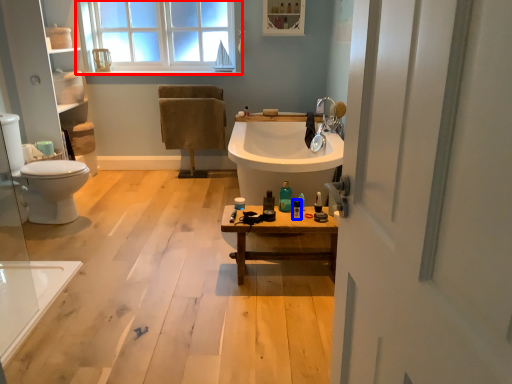
Question: Which of the following is the farthest to the observer, window (highlighted by a red box) or toiletry (highlighted by a blue box)?

Choices:
 (A) window
 (B) toiletry

Answer: (A)